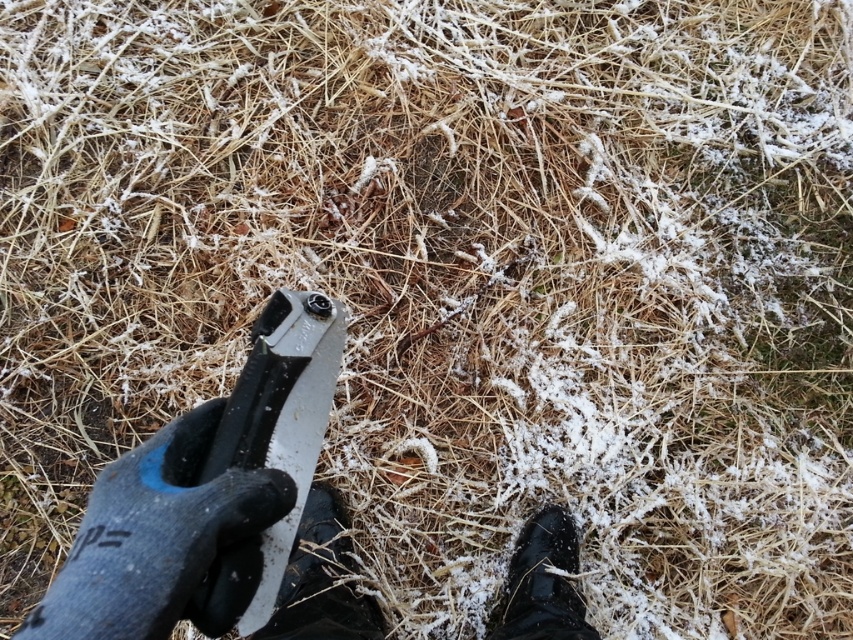
Question: Is black rubber glove at lower left positioned in front of metallic silver pliers at center?

Choices:
 (A) yes
 (B) no

Answer: (B)

Question: Can you confirm if metallic silver pliers at center is thinner than black leather shoe at lower right?

Choices:
 (A) yes
 (B) no

Answer: (A)

Question: Which of these objects is positioned closest to the black rubber shoe at lower center?

Choices:
 (A) metallic silver pliers at center
 (B) black leather shoe at lower right
 (C) black rubber glove at lower left

Answer: (C)

Question: Does black rubber shoe at lower center lie in front of black leather shoe at lower right?

Choices:
 (A) yes
 (B) no

Answer: (A)

Question: Which point is closer to the camera taking this photo?

Choices:
 (A) (549, 545)
 (B) (300, 476)

Answer: (B)

Question: Which point is farther to the camera?

Choices:
 (A) black leather shoe at lower right
 (B) black rubber glove at lower left
 (C) black rubber shoe at lower center
 (D) metallic silver pliers at center

Answer: (A)